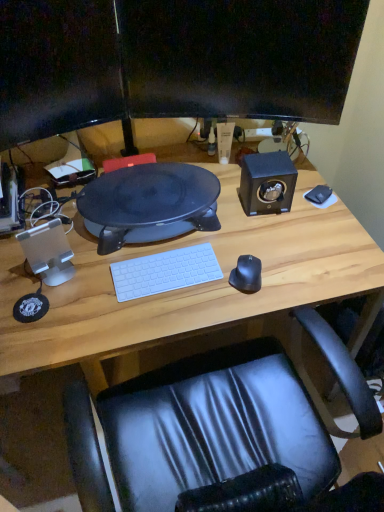
Locate an element on the screen. The image size is (384, 512). vacant space situated on the left part of white matte keyboard at center is located at coordinates (91, 280).